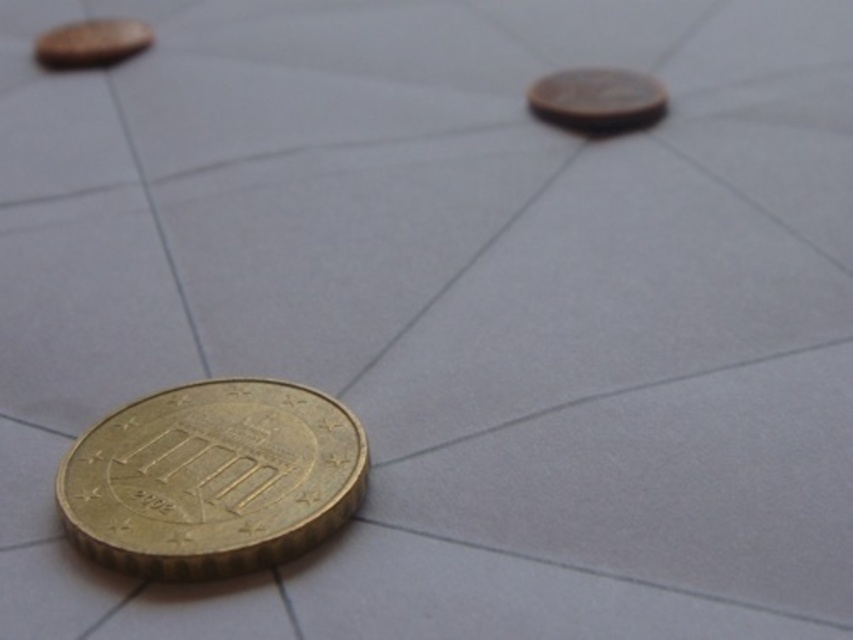
Is point (64, 513) positioned behind point (85, 22)?

No, it is in front of (85, 22).

Does point (192, 445) come farther from viewer compared to point (102, 61)?

No, (192, 445) is in front of (102, 61).

The image size is (853, 640). I want to click on gold metallic coin at lower left, so click(x=212, y=477).

Is point (561, 100) positioned before point (76, 32)?

Yes.

Is brass metallic coin at upper right to the left of matte gold coin at upper left from the viewer's perspective?

No, brass metallic coin at upper right is not to the left of matte gold coin at upper left.

Is point (636, 76) less distant than point (74, 38)?

Yes.

At what (x,y) coordinates should I click in order to perform the action: click on brass metallic coin at upper right. Please return your answer as a coordinate pair (x, y). Looking at the image, I should click on (596, 99).

Is point (265, 381) farther from camera compared to point (659, 100)?

No.

Find the location of a particular element. The width and height of the screenshot is (853, 640). gold metallic coin at lower left is located at coordinates (212, 477).